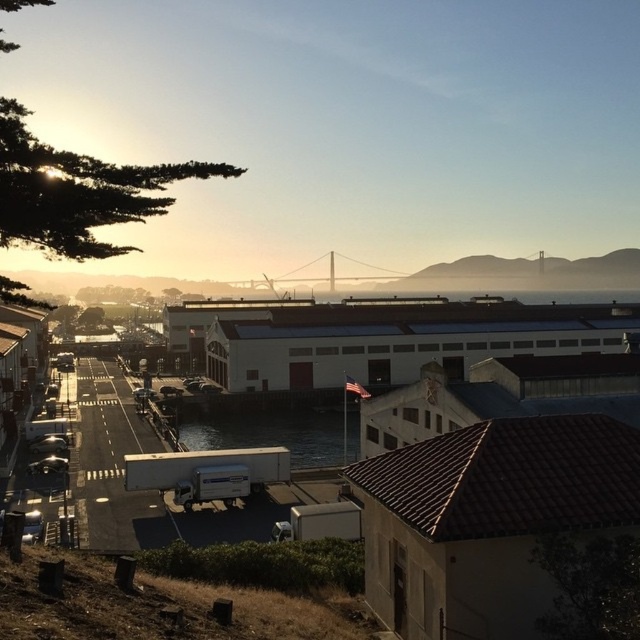
You are a delivery driver who needs to cross the road to reach the clear water at center. Is there enough space between the parked vehicles to maneuver your truck?

The clear water at center is located at point coordinates of (272, 433), so there is sufficient space between the parked vehicles for the delivery driver to maneuver their truck through the road to reach it.

You are standing at the camera position observing the waterfront scene. There is a specific point at coordinates point (x=285, y=413) that you need to reach. Can you estimate how far this point is from your current position?

The distance of point (x=285, y=413) from camera is 110.00 meters, so the point is 110 meters away from your current position.